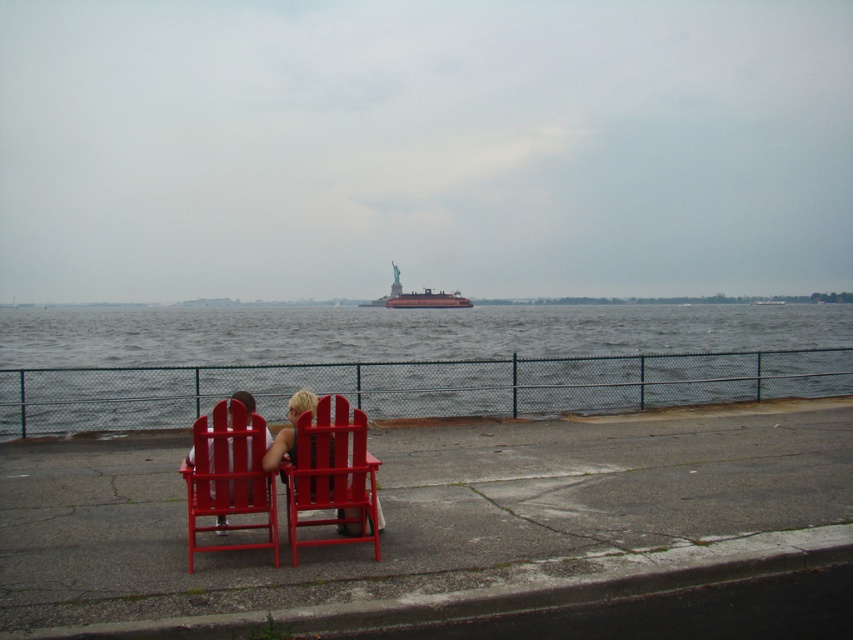
You are planning to place a new table between the smooth glossy wood chair at center and the metallic gray ferry at center. Given that the table must be wider than both objects, can you determine if this is possible?

The smooth glossy wood chair at center is narrower than the metallic gray ferry at center. Since the table must be wider than both, it needs to be wider than the ferry, which is the wider object. Therefore, if the table can be made wider than the ferry, it is possible.

Consider the image. You are standing at the waterfront and want to place a 2.5 meter long boat between the smooth glossy wood chair at center and the water. Is there enough space?

The smooth glossy wood chair at center is 6.04 meters away from the viewer. Since the boat is 2.5 meters long, there is sufficient space between the smooth glossy wood chair at center and the water to accommodate it.

You are standing at the entrance of the waterfront area and see the smooth glossy wood chair at center. If you walk straight ahead, will you reach the chair before the water?

The smooth glossy wood chair at center is located at point (229, 476), which is closer to the entrance than the water. Therefore, you will reach the chair before the water.